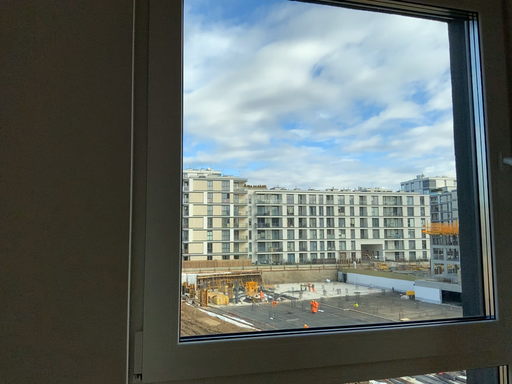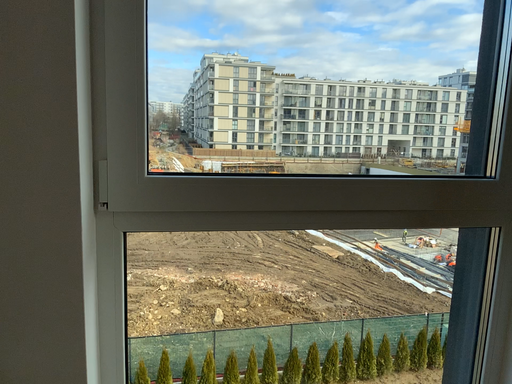
Question: How did the camera likely rotate when shooting the video?

Choices:
 (A) rotated downward
 (B) rotated upward

Answer: (A)